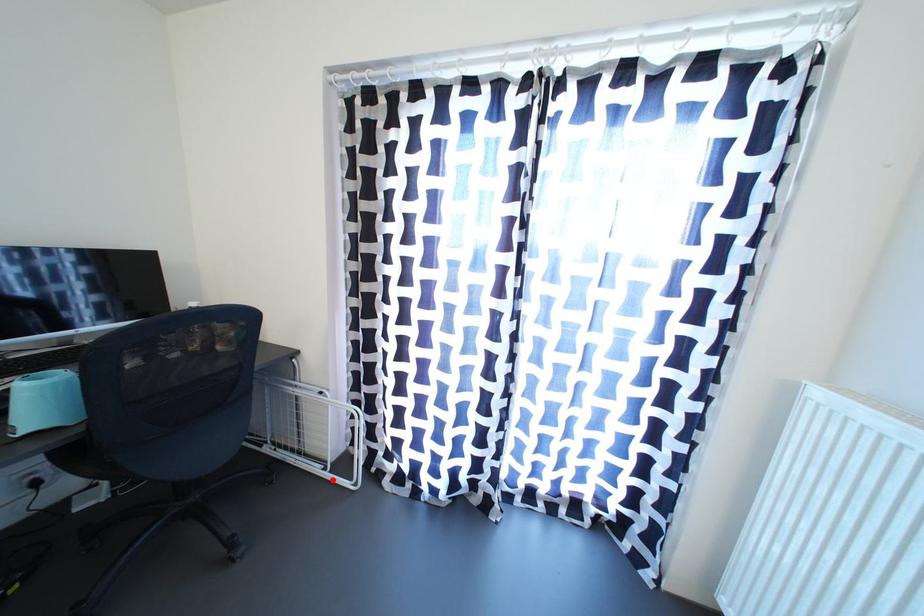
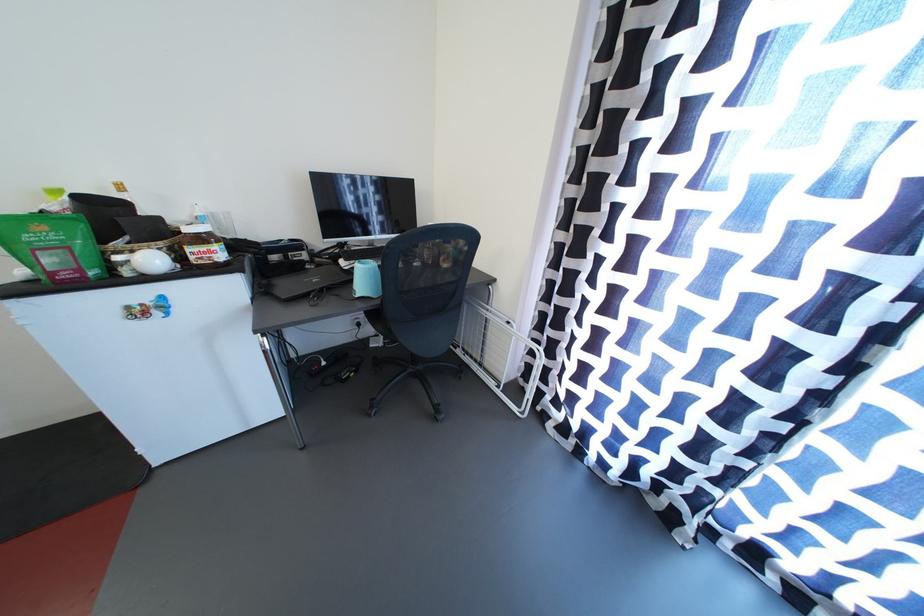
Locate, in the second image, the point that corresponds to the highlighted location in the first image.

(505, 397)